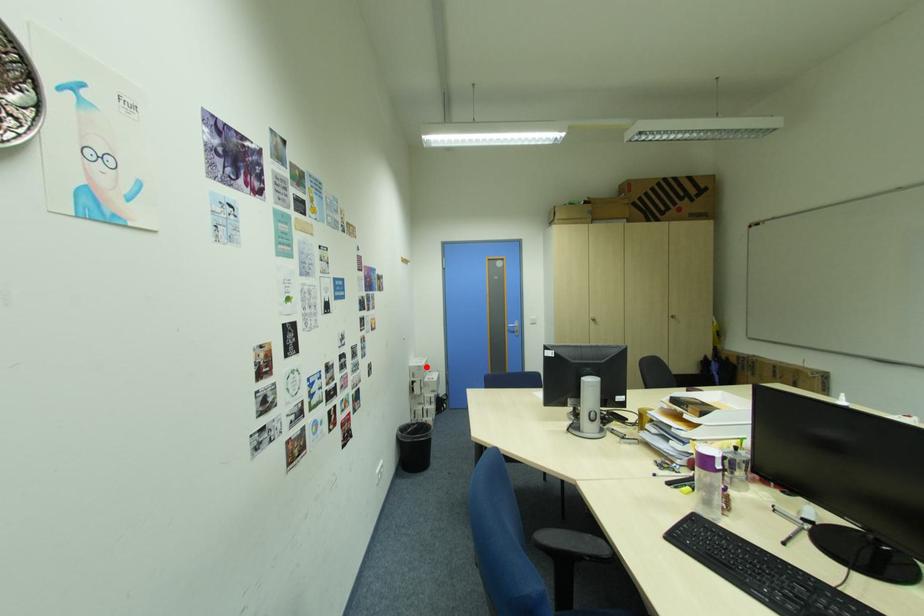
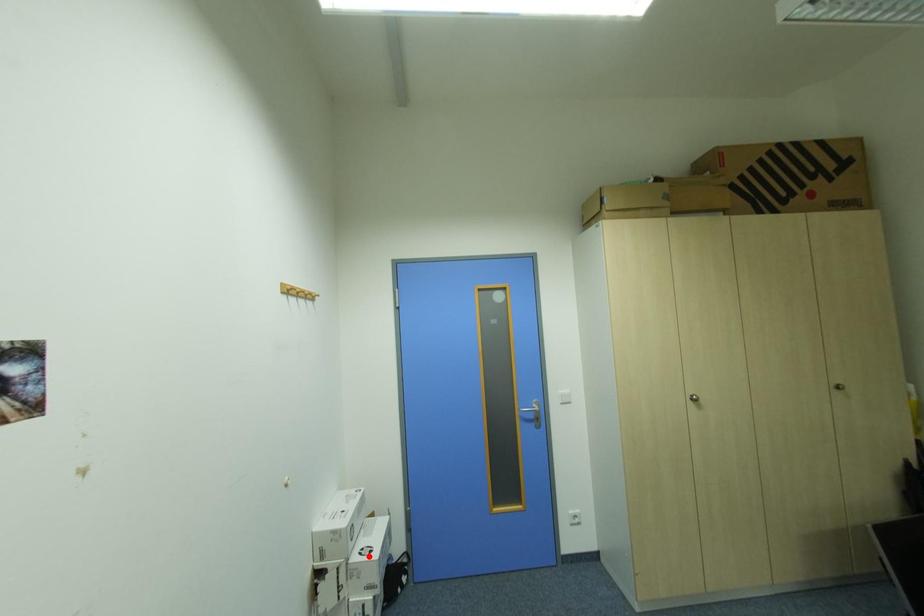
I am providing you with two images of the same scene from different viewpoints. A red point is marked on the first image and another point is marked on the second image. Do the highlighted points in image1 and image2 indicate the same real-world spot?

No